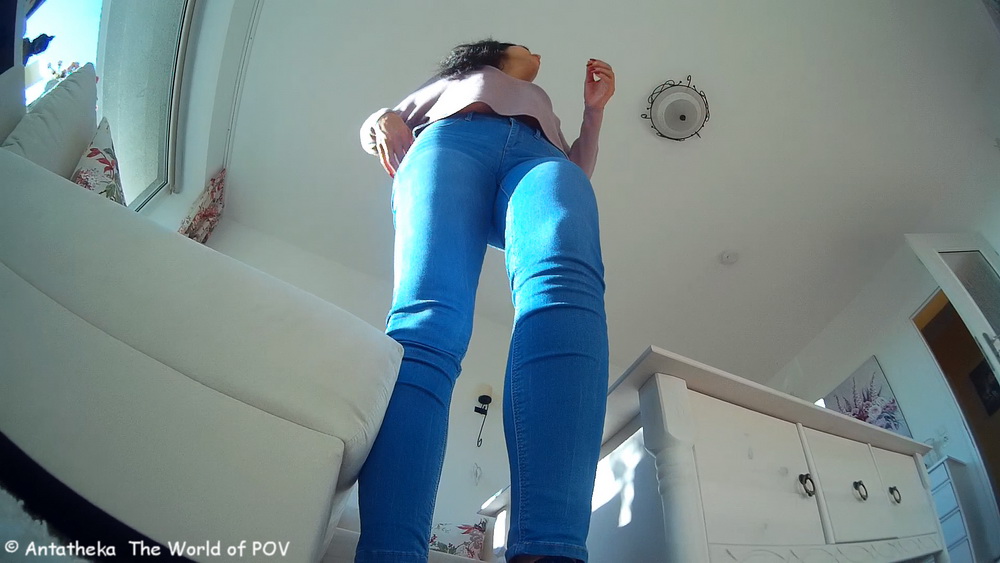
Locate an element on the screen. The width and height of the screenshot is (1000, 563). painting is located at coordinates (864, 386).